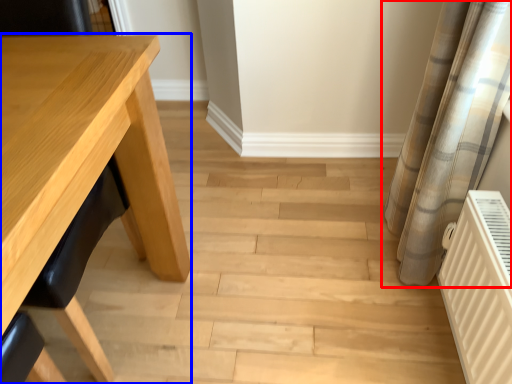
Question: Which object appears farthest to the camera in this image, curtain (highlighted by a red box) or table (highlighted by a blue box)?

Choices:
 (A) curtain
 (B) table

Answer: (A)